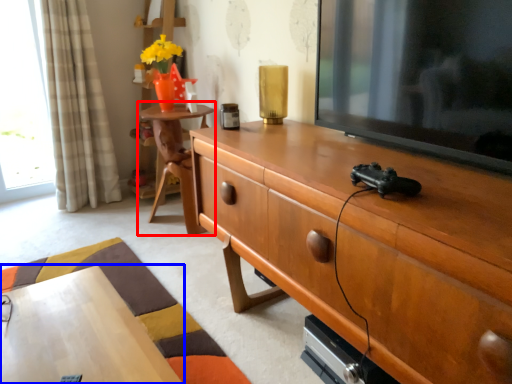
Question: Which object appears farthest to the camera in this image, table (highlighted by a red box) or desk (highlighted by a blue box)?

Choices:
 (A) table
 (B) desk

Answer: (A)